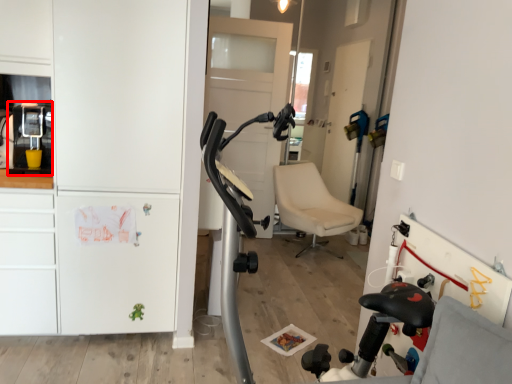
Question: Observing the image, what is the correct spatial positioning of appliance (annotated by the red box) in reference to dresser?

Choices:
 (A) left
 (B) right

Answer: (A)